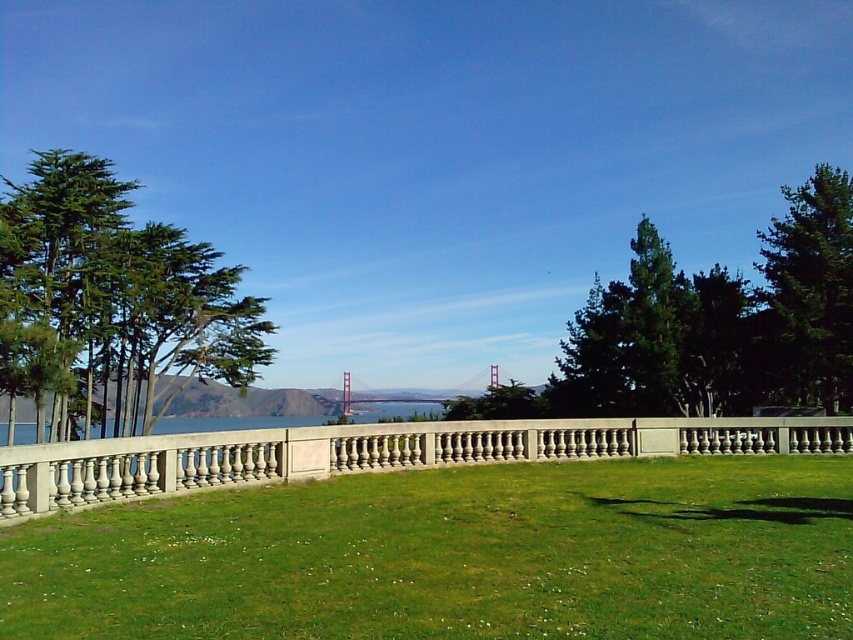
Does green grass at center have a lesser width compared to green textured tree at right?

Yes, green grass at center is thinner than green textured tree at right.

Is point (831, 636) closer to camera compared to point (825, 200)?

Yes, it is in front of point (825, 200).

Locate an element on the screen. The height and width of the screenshot is (640, 853). green grass at center is located at coordinates (456, 556).

Between green grass at center and green needle-like foliage at left, which one has less height?

green grass at center is shorter.

At what (x,y) coordinates should I click in order to perform the action: click on green grass at center. Please return your answer as a coordinate pair (x, y). Image resolution: width=853 pixels, height=640 pixels. Looking at the image, I should click on (456, 556).

Is green needle-like foliage at left below green textured tree at right?

Incorrect, green needle-like foliage at left is not positioned below green textured tree at right.

Measure the distance between point [209,244] and camera.

Point [209,244] is 180.50 feet away from camera.

The width and height of the screenshot is (853, 640). Describe the element at coordinates (112, 300) in the screenshot. I see `green needle-like foliage at left` at that location.

The width and height of the screenshot is (853, 640). Identify the location of green needle-like foliage at left. (112, 300).